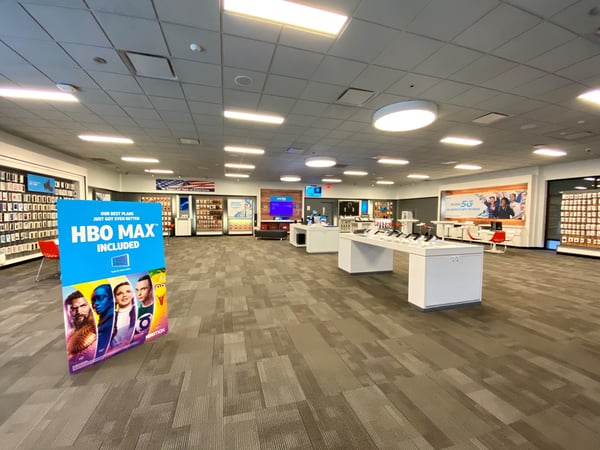
Find the location of a particular element. This screenshot has height=450, width=600. ceiling is located at coordinates (232, 84).